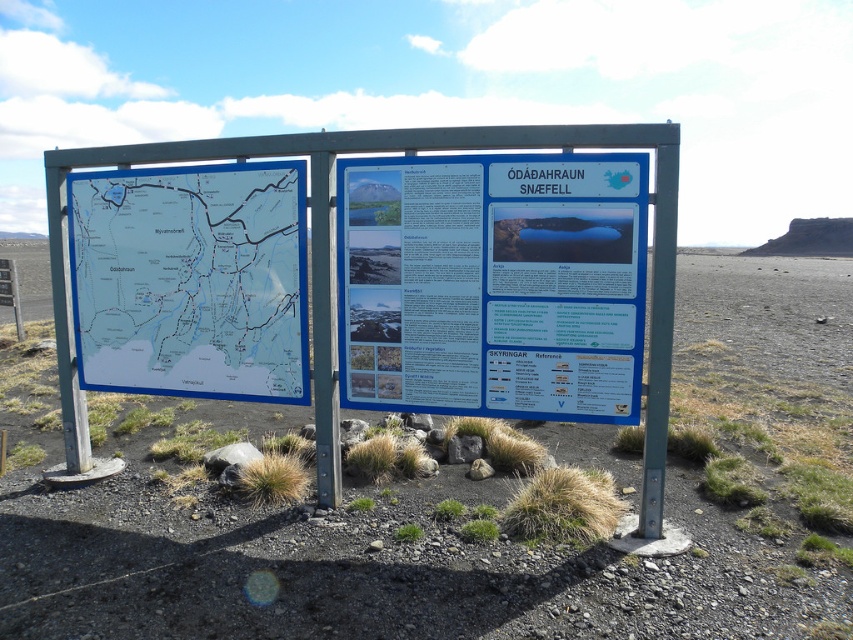
Does black gravel desert at center have a lesser width compared to metallic pole at center?

No.

Between black gravel desert at center and metallic pole at center, which one is positioned higher?

metallic pole at center is above.

Between point (438, 611) and point (314, 163), which one is positioned in front?

Point (438, 611)

Locate an element on the screen. The width and height of the screenshot is (853, 640). black gravel desert at center is located at coordinates (450, 499).

Is blue paper map at left above metallic pole at center?

Correct, blue paper map at left is located above metallic pole at center.

Is blue paper map at left wider than metallic pole at center?

Correct, the width of blue paper map at left exceeds that of metallic pole at center.

This screenshot has width=853, height=640. What do you see at coordinates (190, 280) in the screenshot?
I see `blue paper map at left` at bounding box center [190, 280].

Where is `blue paper map at left`? Image resolution: width=853 pixels, height=640 pixels. blue paper map at left is located at coordinates (190, 280).

Does point (258, 563) come behind point (376, 378)?

No, it is in front of (376, 378).

Does black gravel desert at center have a greater height compared to white paper sign at center?

Indeed, black gravel desert at center has a greater height compared to white paper sign at center.

The image size is (853, 640). What are the coordinates of `black gravel desert at center` in the screenshot? It's located at (450, 499).